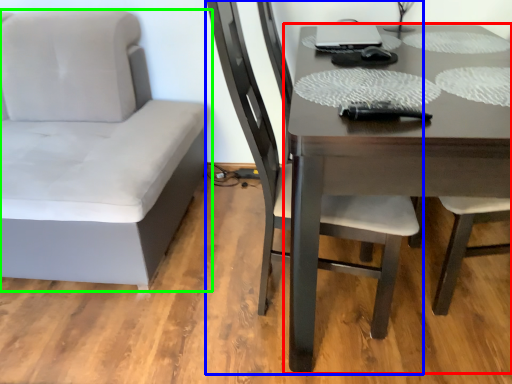
Question: Which object is positioned closest to table (highlighted by a red box)? Select from chair (highlighted by a blue box) and chair (highlighted by a green box).

Choices:
 (A) chair
 (B) chair

Answer: (A)